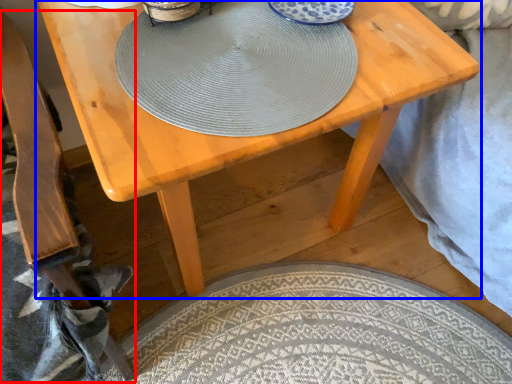
Question: Which point is closer to the camera, armchair (highlighted by a red box) or table (highlighted by a blue box)?

Choices:
 (A) armchair
 (B) table

Answer: (A)